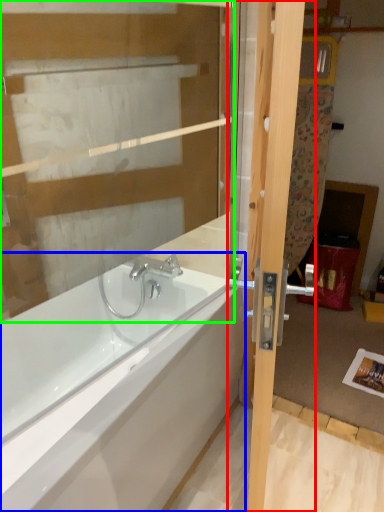
Question: Which object is positioned closest to door (highlighted by a red box)? Select from bathtub (highlighted by a blue box) and glass door (highlighted by a green box).

Choices:
 (A) bathtub
 (B) glass door

Answer: (B)